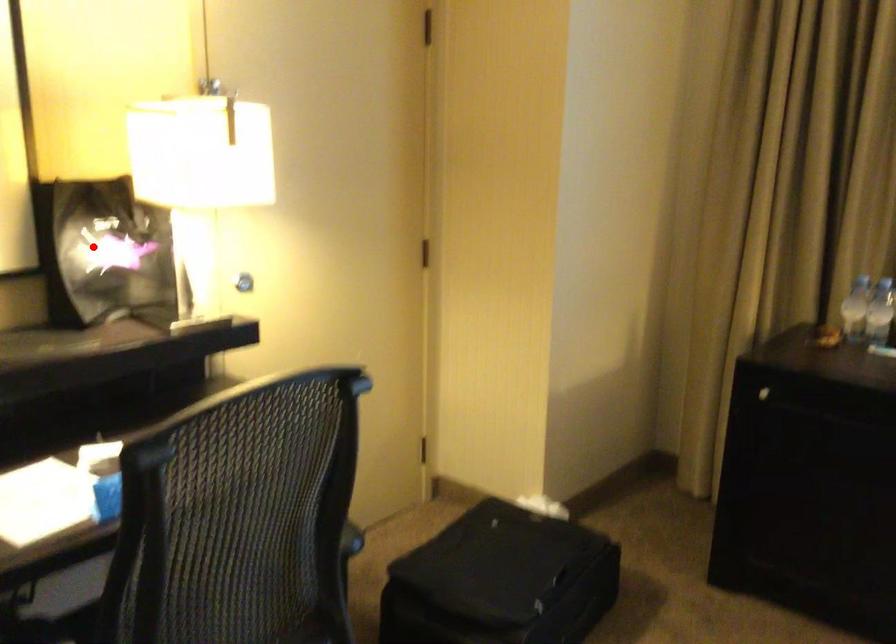
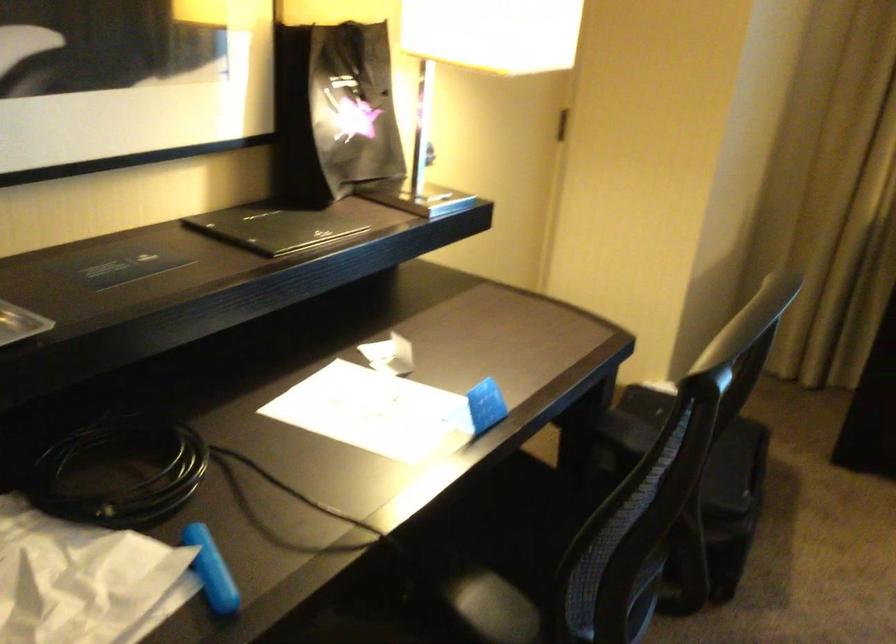
Question: I am providing you with two images of the same scene from different viewpoints. Given a red point in image1, look at the same physical point in image2. Is it:

Choices:
 (A) Closer to the viewpoint
 (B) Farther from the viewpoint

Answer: (A)